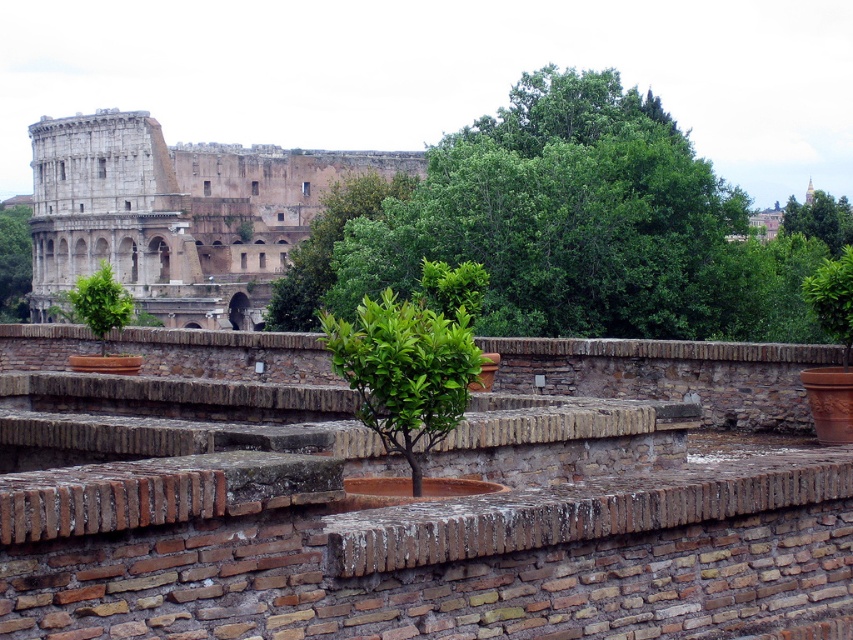
Can you confirm if green leafy tree at center is shorter than green leafy tree at left?

Yes.

Is green leafy tree at center wider than green leafy tree at left?

Yes.

Find the location of a particular element. green leafy tree at center is located at coordinates (569, 227).

The width and height of the screenshot is (853, 640). Find the location of `green leafy tree at center`. green leafy tree at center is located at coordinates (569, 227).

Which is behind, point (6, 317) or point (117, 321)?

The point (6, 317) is behind.

Describe the element at coordinates (15, 262) in the screenshot. Image resolution: width=853 pixels, height=640 pixels. I see `green leafy tree at left` at that location.

I want to click on green leafy tree at left, so click(x=15, y=262).

Who is more forward, (x=526, y=131) or (x=248, y=177)?

Point (x=526, y=131) is in front.

Is green leafy tree at center above stone amphitheater at upper left?

Actually, green leafy tree at center is below stone amphitheater at upper left.

At what (x,y) coordinates should I click in order to perform the action: click on green leafy tree at center. Please return your answer as a coordinate pair (x, y). The image size is (853, 640). Looking at the image, I should click on (569, 227).